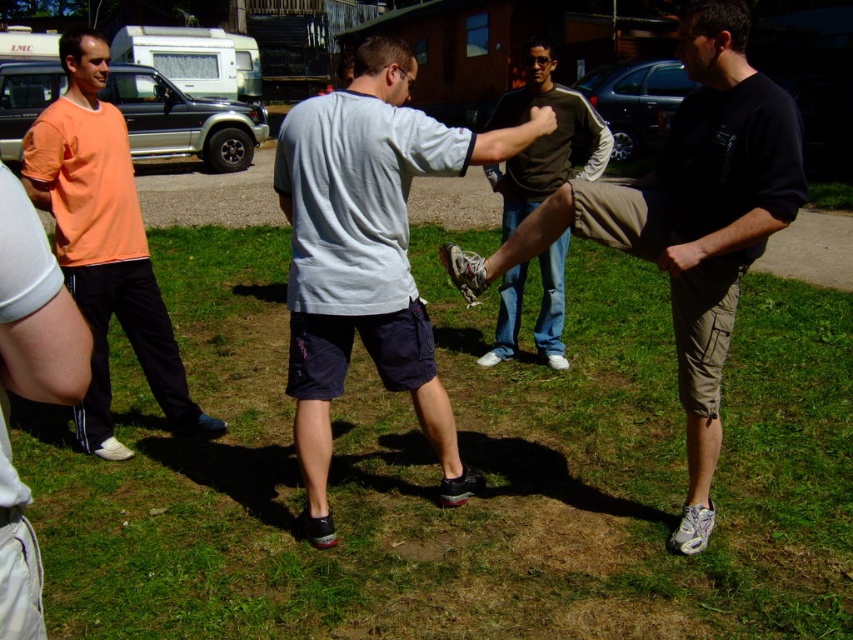
Question: Is orange cotton t-shirt at left further to the viewer compared to matte orange t-shirt at left?

Choices:
 (A) yes
 (B) no

Answer: (A)

Question: Which is nearer to the khaki cotton shorts at center?

Choices:
 (A) orange cotton t-shirt at left
 (B) green grass at lower center
 (C) matte orange t-shirt at left
 (D) dark brown leather pants at center

Answer: (B)

Question: Which point appears farthest from the camera in this image?

Choices:
 (A) (109, 589)
 (B) (39, 298)
 (C) (381, 292)
 (D) (718, 352)

Answer: (C)

Question: Is green grass at lower center smaller than orange cotton t-shirt at left?

Choices:
 (A) yes
 (B) no

Answer: (A)

Question: Which point is farther to the camera?

Choices:
 (A) green grass at lower center
 (B) dark gray cotton t-shirt at center
 (C) dark brown leather pants at center

Answer: (C)

Question: Is green grass at lower center positioned at the back of dark gray cotton t-shirt at center?

Choices:
 (A) no
 (B) yes

Answer: (A)